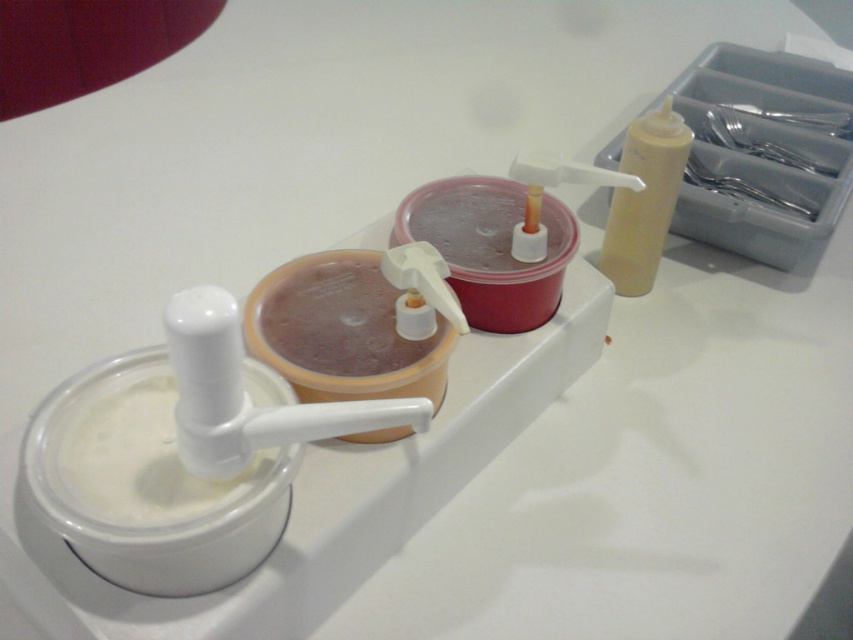
Question: Can you confirm if white matte milk at lower left is bigger than matte yellow squeeze bottle at upper right?

Choices:
 (A) no
 (B) yes

Answer: (A)

Question: Which point is farther to the camera?

Choices:
 (A) (641, 253)
 (B) (67, 452)

Answer: (A)

Question: Does white matte milk at lower left appear on the left side of matte yellow squeeze bottle at upper right?

Choices:
 (A) no
 (B) yes

Answer: (B)

Question: Does white matte milk at lower left appear on the left side of matte yellow squeeze bottle at upper right?

Choices:
 (A) yes
 (B) no

Answer: (A)